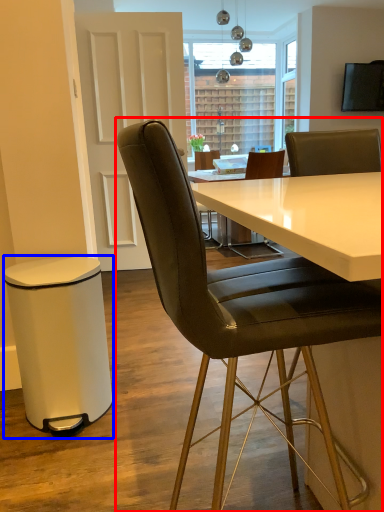
Question: Among these objects, which one is farthest to the camera, chair (highlighted by a red box) or bar stool (highlighted by a blue box)?

Choices:
 (A) chair
 (B) bar stool

Answer: (B)